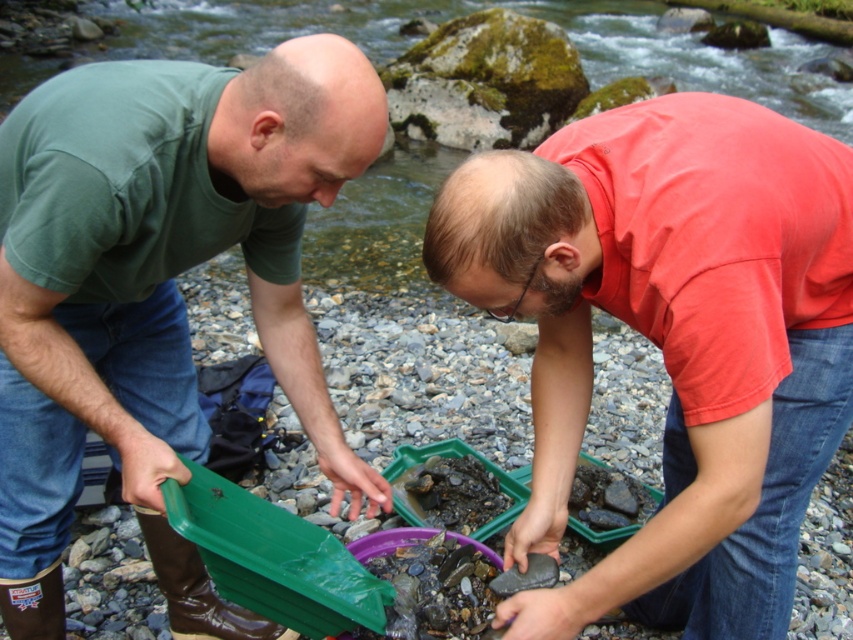
Question: Which point is farther from the camera taking this photo?

Choices:
 (A) [x=627, y=129]
 (B) [x=222, y=188]

Answer: (B)

Question: Can you confirm if matte red shirt at center is wider than green matte tray at left?

Choices:
 (A) yes
 (B) no

Answer: (B)

Question: In this image, where is matte red shirt at center located relative to green matte tray at left?

Choices:
 (A) above
 (B) below

Answer: (B)

Question: Is matte red shirt at center to the right of green matte tray at left from the viewer's perspective?

Choices:
 (A) no
 (B) yes

Answer: (B)